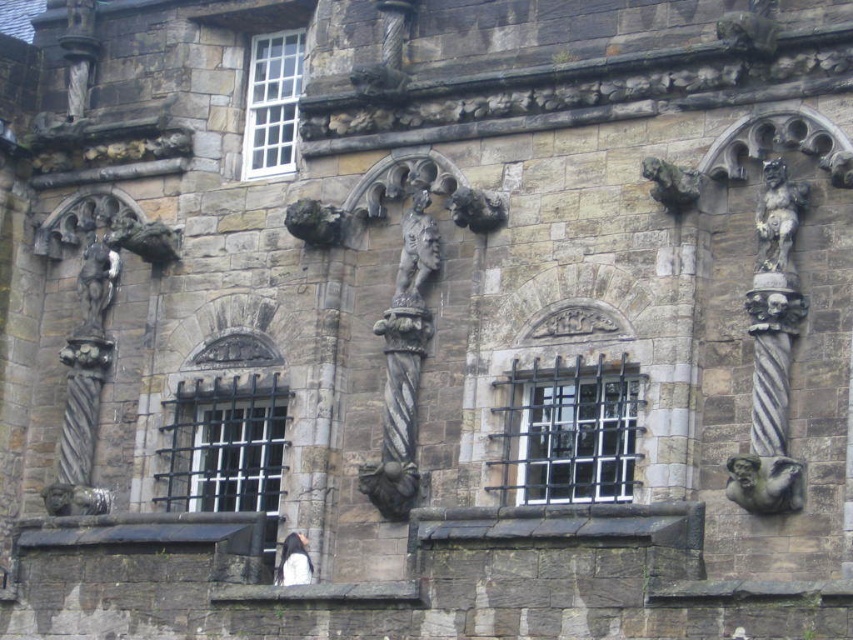
You are standing at the camera position and want to take a photo of the bronze textured figure at center. Considering the distance between you and the figure, will you need a telephoto lens to capture the figure clearly in your shot?

The bronze textured figure at center and camera are 62.09 meters apart from each other. At this distance, a telephoto lens would be necessary to capture the figure clearly in your shot.

You are standing in front of a historic stone building and want to take a photo of the white wooden window at upper center. If your camera can focus on objects up to 70 meters away, will you need to adjust your position?

The white wooden window at upper center is 72.17 meters away from camera, which is beyond the camera focus range of 70 meters. You need to move closer to ensure proper focus.